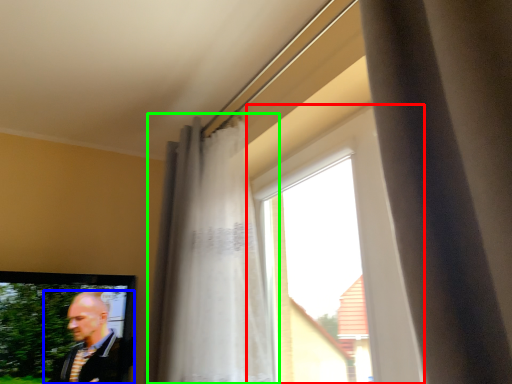
Question: Considering the real-world distances, which object is farthest from window (highlighted by a red box)? man (highlighted by a blue box) or curtain (highlighted by a green box)?

Choices:
 (A) man
 (B) curtain

Answer: (A)